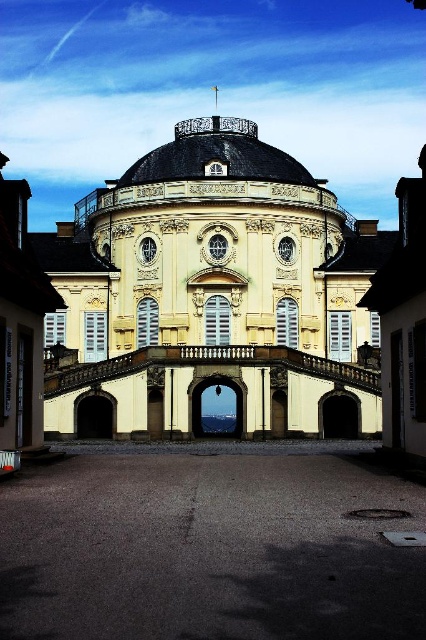
Does beige stucco palace at center appear under gray asphalt at center?

Incorrect, beige stucco palace at center is not positioned below gray asphalt at center.

The height and width of the screenshot is (640, 426). Describe the element at coordinates (213, 296) in the screenshot. I see `beige stucco palace at center` at that location.

Locate an element on the screen. This screenshot has height=640, width=426. beige stucco palace at center is located at coordinates (213, 296).

You are a GUI agent. You are given a task and a screenshot of the screen. Output one action in this format:
    pyautogui.click(x=<x>, y=<y>)
    Task: Click on the beige stucco palace at center
    This screenshot has width=426, height=640.
    Given the screenshot: What is the action you would take?
    pyautogui.click(x=213, y=296)